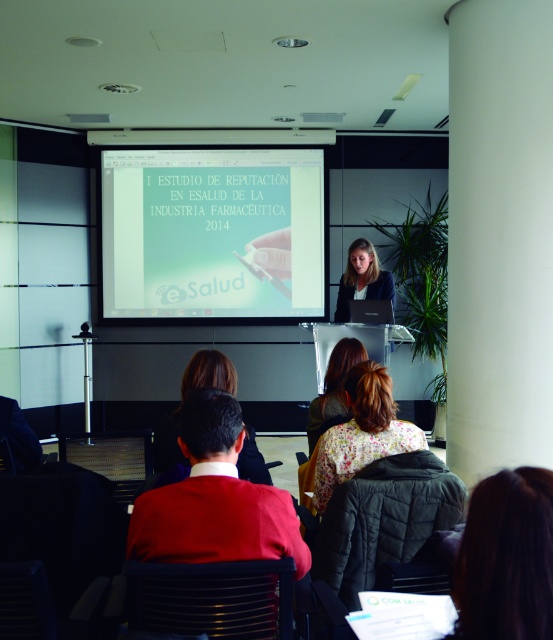
You are attending a presentation in the conference room and need to locate the white glossy projector screen at center. According to the coordinates provided, where exactly is it positioned?

The white glossy projector screen at center is positioned at coordinates point (212, 232).

You are an event planner observing the presentation setup. You notice two items at the center of the image, the red wool sweater at center and the floral fabric dress at center. Which one is positioned lower in the image?

The red wool sweater at center is located below the floral fabric dress at center, so it is positioned lower in the image.